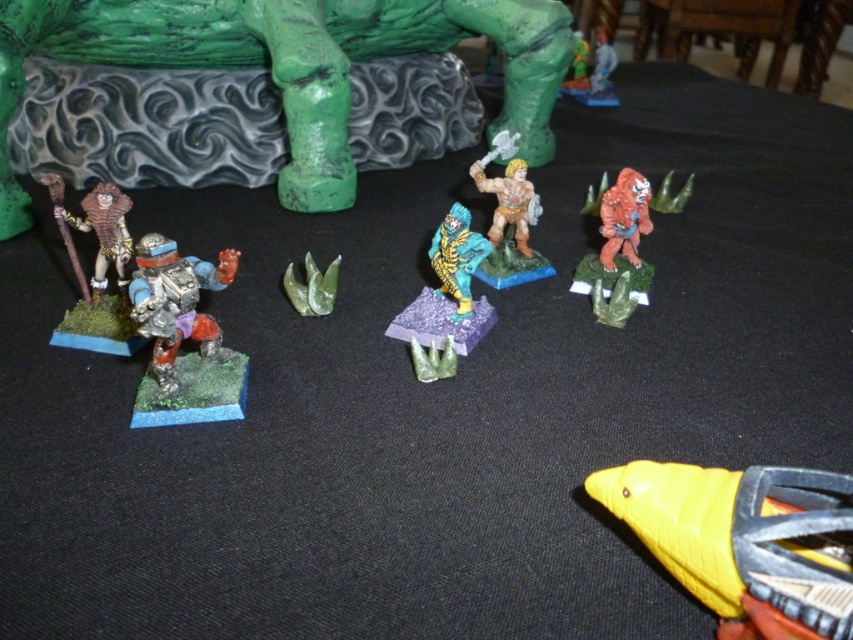
You are a player trying to place a new figurine on the table. You have two options for placement points marked as point 1 at coordinates point (625, 193) and point 2 at coordinates point (595, 64). Which point is closer to you?

Point 1 at coordinates point (625, 193) is closer to you than point 2 at coordinates point (595, 64).

You are a game master preparing a tabletop game scene. You need to place a new small dice set between the brushed metal statue at upper left and the metallic silver sword at upper right. Considering their sizes, which object will the dice set be closer to?

The dice set will be closer to the metallic silver sword at upper right because the brushed metal statue at upper left is bigger than the metallic silver sword at upper right, so the sword is smaller and thus closer to the dice set.

You are setting up a display for a fantasy exhibition and need to arrange the brushed metal statue at upper left and the metallic silver sword at upper right. According to the scene, which object is positioned to the left of the other?

The brushed metal statue at upper left is to the left of metallic silver sword at upper right.